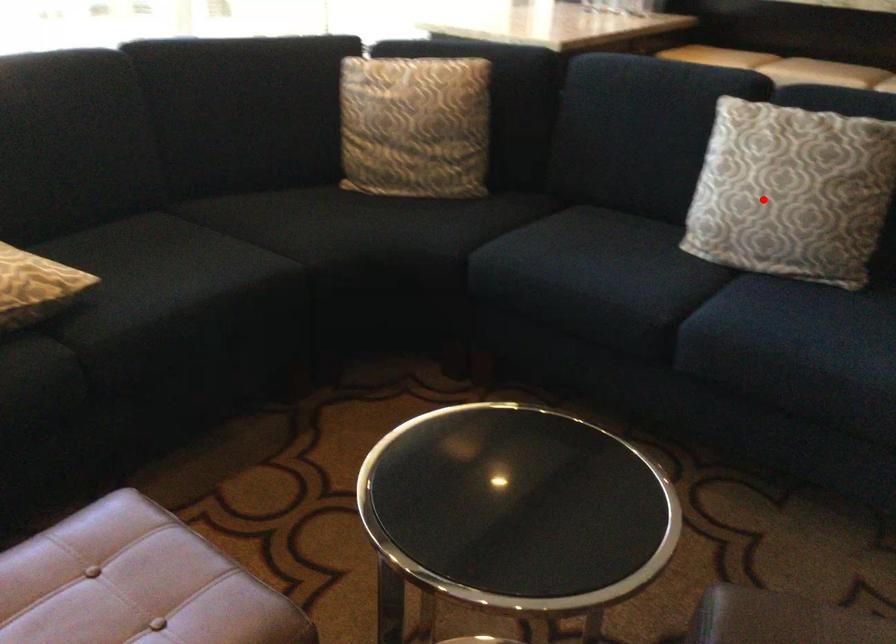
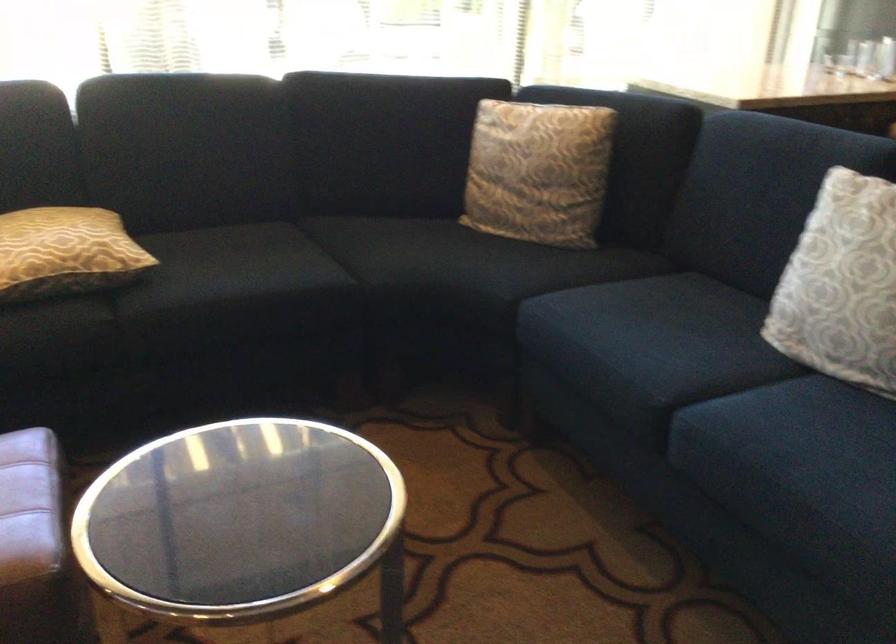
Find the pixel in the second image that matches the highlighted location in the first image.

(841, 285)